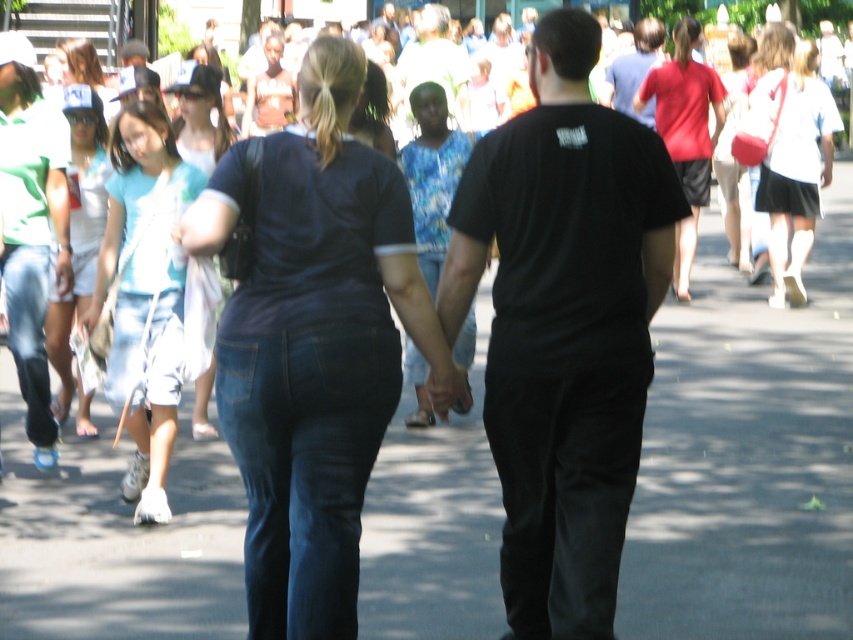
Question: Does dark blue denim jeans at center appear over matte brown shirt at center?

Choices:
 (A) yes
 (B) no

Answer: (B)

Question: Among these points, which one is farthest from the camera?

Choices:
 (A) (421, 204)
 (B) (614, 60)
 (C) (97, 108)
 (D) (688, 40)

Answer: (B)

Question: Does light blue denim jeans at center appear over matte black shirt at upper center?

Choices:
 (A) yes
 (B) no

Answer: (B)

Question: Which is nearer to the matte blue shirt at upper left?

Choices:
 (A) black matte shirt at center
 (B) white matte shirt at upper right
 (C) matte black shirt at upper center

Answer: (C)

Question: Which of the following is the closest to the observer?

Choices:
 (A) matte red shirt at upper right
 (B) light blue denim shorts at left
 (C) light blue denim jeans at center
 (D) blue floral blouse at center

Answer: (B)

Question: Is dark blue denim jeans at center positioned before light blue denim shorts at left?

Choices:
 (A) no
 (B) yes

Answer: (B)